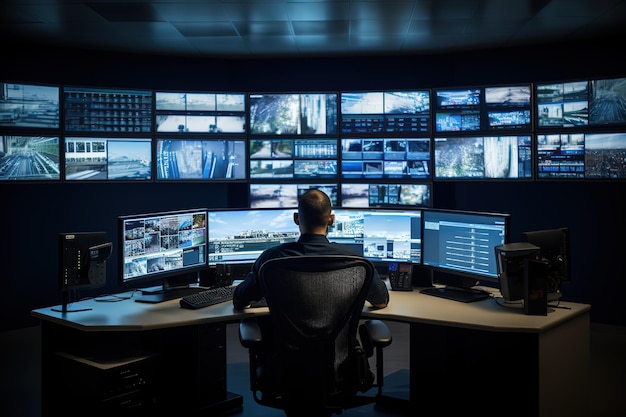
In order to click on video screens in the bottom row in this screenshot , I will do `click(176, 238)`, `click(250, 232)`, `click(377, 225)`, `click(480, 231)`.